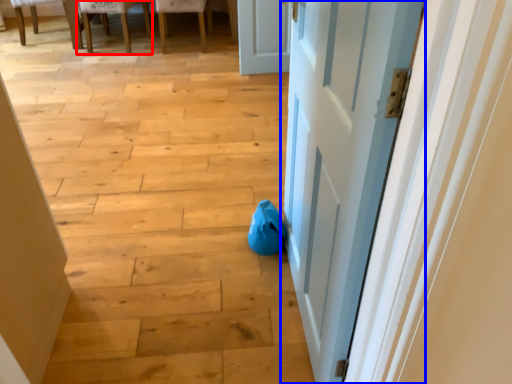
Question: Among these objects, which one is nearest to the camera, chair (highlighted by a red box) or door (highlighted by a blue box)?

Choices:
 (A) chair
 (B) door

Answer: (B)